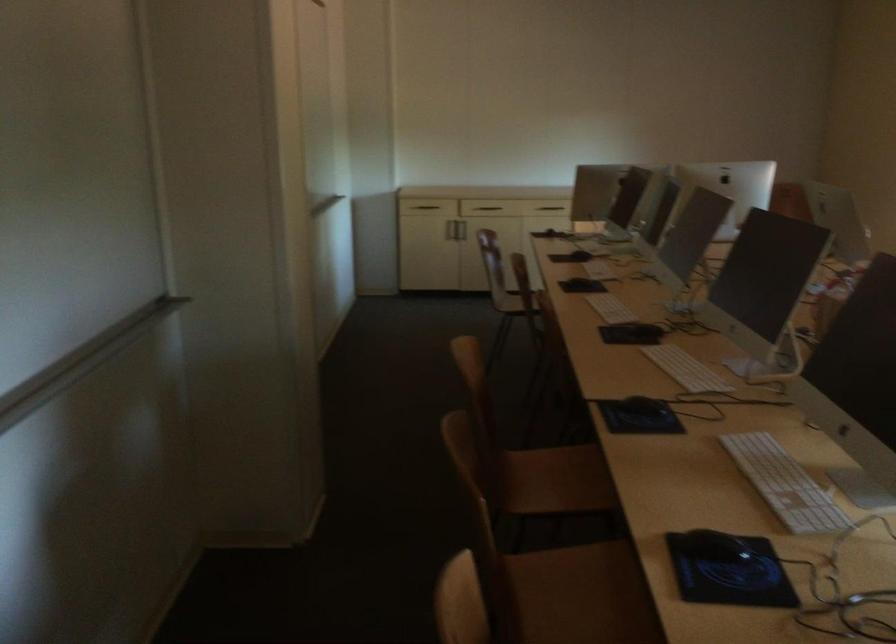
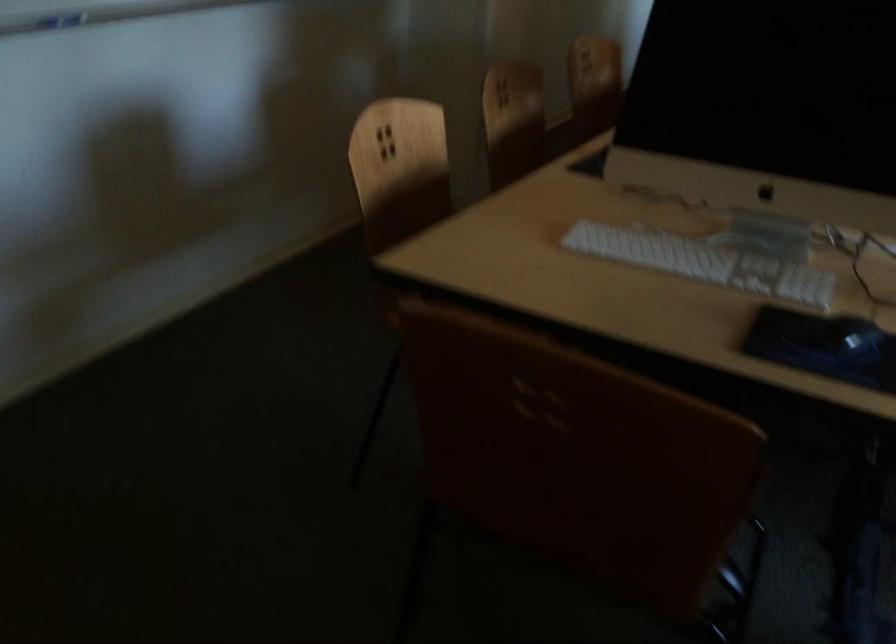
Question: I am providing you with two images of the same scene from different viewpoints. Which of the following objects are not visible in image2?

Choices:
 (A) wooden chair sitting surface
 (B) black computer mouse
 (C) badminton racket
 (D) white keyboard

Answer: (A)